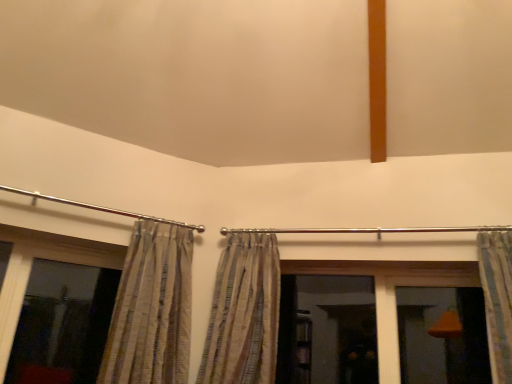
This screenshot has height=384, width=512. Describe the element at coordinates (497, 299) in the screenshot. I see `striped fabric curtain at right, which ranks as the 1th curtain in right-to-left order` at that location.

Describe the element at coordinates (151, 309) in the screenshot. I see `striped fabric curtain at left, which is the first curtain in left-to-right order` at that location.

You are a GUI agent. You are given a task and a screenshot of the screen. Output one action in this format:
    pyautogui.click(x=<x>, y=<y>)
    Task: Click on the striped fabric curtain at right, which ranks as the 1th curtain in right-to-left order
    This screenshot has height=384, width=512.
    Given the screenshot: What is the action you would take?
    pyautogui.click(x=497, y=299)

Is striped fabric curtain at left, which is the first curtain in left-to-right order, located outside striped fabric curtain at center, which is the second curtain from right to left?

Absolutely, striped fabric curtain at left, which is the first curtain in left-to-right order, is external to striped fabric curtain at center, which is the second curtain from right to left.

Is striped fabric curtain at left, which is the third curtain from right to left, wider or thinner than striped fabric curtain at center, which is the second curtain from right to left?

Clearly, striped fabric curtain at left, which is the third curtain from right to left, has less width compared to striped fabric curtain at center, which is the second curtain from right to left.

From a real-world perspective, is striped fabric curtain at left, which is the first curtain in left-to-right order, physically above striped fabric curtain at center, marked as the second curtain in a left-to-right arrangement?

Actually, striped fabric curtain at left, which is the first curtain in left-to-right order, is physically below striped fabric curtain at center, marked as the second curtain in a left-to-right arrangement, in the real world.

Is striped fabric curtain at left, which is the third curtain from right to left, placed right next to striped fabric curtain at center, which is the second curtain from right to left?

No, striped fabric curtain at left, which is the third curtain from right to left, is not touching striped fabric curtain at center, which is the second curtain from right to left.

Can you confirm if striped fabric curtain at left, which is the first curtain in left-to-right order, is shorter than transparent glass window at left?

Incorrect, the height of striped fabric curtain at left, which is the first curtain in left-to-right order, does not fall short of that of transparent glass window at left.

From a real-world perspective, is striped fabric curtain at left, which is the third curtain from right to left, physically located above or below transparent glass window at left?

striped fabric curtain at left, which is the third curtain from right to left, is above transparent glass window at left.

Is striped fabric curtain at left, which is the third curtain from right to left, positioned before transparent glass window at left?

Yes, striped fabric curtain at left, which is the third curtain from right to left, is in front of transparent glass window at left.

Locate an element on the screen. The width and height of the screenshot is (512, 384). window behind the striped fabric curtain at left, which is the first curtain in left-to-right order is located at coordinates (30, 269).

Is striped fabric curtain at left, which is the third curtain from right to left, at the left side of striped fabric curtain at right, which ranks as the 1th curtain in right-to-left order?

Correct, you'll find striped fabric curtain at left, which is the third curtain from right to left, to the left of striped fabric curtain at right, which ranks as the 1th curtain in right-to-left order.

The height and width of the screenshot is (384, 512). Identify the location of the 2nd curtain directly beneath the striped fabric curtain at right, the third curtain when ordered from left to right (from a real-world perspective). (151, 309).

From the image's perspective, is striped fabric curtain at left, which is the first curtain in left-to-right order, positioned above or below striped fabric curtain at right, the third curtain when ordered from left to right?

striped fabric curtain at left, which is the first curtain in left-to-right order, is situated lower than striped fabric curtain at right, the third curtain when ordered from left to right, in the image.

Is striped fabric curtain at left, which is the first curtain in left-to-right order, bigger than striped fabric curtain at right, the third curtain when ordered from left to right?

Indeed, striped fabric curtain at left, which is the first curtain in left-to-right order, has a larger size compared to striped fabric curtain at right, the third curtain when ordered from left to right.

Between transparent glass window at left and striped fabric curtain at center, marked as the second curtain in a left-to-right arrangement, which one has smaller size?

transparent glass window at left is smaller.

From a real-world perspective, is transparent glass window at left physically located above or below striped fabric curtain at center, which is the second curtain from right to left?

From a real-world perspective, transparent glass window at left is physically below striped fabric curtain at center, which is the second curtain from right to left.

In the scene shown: How many degrees apart are the facing directions of transparent glass window at left and striped fabric curtain at center, marked as the second curtain in a left-to-right arrangement?

45.2 degrees separate the facing orientations of transparent glass window at left and striped fabric curtain at center, marked as the second curtain in a left-to-right arrangement.

Can you confirm if transparent glass window at left is taller than striped fabric curtain at center, marked as the second curtain in a left-to-right arrangement?

No.

How many degrees apart are the facing directions of striped fabric curtain at center, which is the second curtain from right to left, and striped fabric curtain at left, which is the first curtain in left-to-right order?

There is a 36.2-degree angle between the facing directions of striped fabric curtain at center, which is the second curtain from right to left, and striped fabric curtain at left, which is the first curtain in left-to-right order.

Does striped fabric curtain at center, marked as the second curtain in a left-to-right arrangement, contain striped fabric curtain at left, which is the first curtain in left-to-right order?

Actually, striped fabric curtain at left, which is the first curtain in left-to-right order, is outside striped fabric curtain at center, marked as the second curtain in a left-to-right arrangement.

Is striped fabric curtain at center, marked as the second curtain in a left-to-right arrangement, at the right side of striped fabric curtain at left, which is the first curtain in left-to-right order?

Yes.

Is striped fabric curtain at center, marked as the second curtain in a left-to-right arrangement, facing away from striped fabric curtain at left, which is the third curtain from right to left?

No, striped fabric curtain at center, marked as the second curtain in a left-to-right arrangement, is not facing away from striped fabric curtain at left, which is the third curtain from right to left.

Is striped fabric curtain at right, the third curtain when ordered from left to right, taller than striped fabric curtain at center, marked as the second curtain in a left-to-right arrangement?

In fact, striped fabric curtain at right, the third curtain when ordered from left to right, may be shorter than striped fabric curtain at center, marked as the second curtain in a left-to-right arrangement.

From a real-world perspective, who is located lower, striped fabric curtain at right, which ranks as the 1th curtain in right-to-left order, or striped fabric curtain at center, marked as the second curtain in a left-to-right arrangement?

striped fabric curtain at center, marked as the second curtain in a left-to-right arrangement, from a real-world perspective.

Considering the relative positions of striped fabric curtain at right, the third curtain when ordered from left to right, and striped fabric curtain at center, which is the second curtain from right to left, in the image provided, is striped fabric curtain at right, the third curtain when ordered from left to right, in front of striped fabric curtain at center, which is the second curtain from right to left,?

Yes, it is in front of striped fabric curtain at center, which is the second curtain from right to left.

Locate an element on the screen. This screenshot has height=384, width=512. the 2nd curtain behind the striped fabric curtain at right, which ranks as the 1th curtain in right-to-left order is located at coordinates (244, 312).

Is striped fabric curtain at center, marked as the second curtain in a left-to-right arrangement, far away from transparent glass window at left?

No.

Considering the relative sizes of striped fabric curtain at center, which is the second curtain from right to left, and transparent glass window at left in the image provided, is striped fabric curtain at center, which is the second curtain from right to left, wider than transparent glass window at left?

Yes.

From the image's perspective, which curtain is the 1st one above the transparent glass window at left? Please provide its 2D coordinates.

[(244, 312)]

Identify the location of the 1st curtain to the right of the striped fabric curtain at left, which is the third curtain from right to left, starting your count from the anchor. (244, 312).

From the image's perspective, starting from the transparent glass window at left, which curtain is the 2nd one above? Please provide its 2D coordinates.

[(151, 309)]

When comparing their distances from transparent glass window at left, does striped fabric curtain at center, marked as the second curtain in a left-to-right arrangement, or striped fabric curtain at left, which is the third curtain from right to left, seem further?

striped fabric curtain at center, marked as the second curtain in a left-to-right arrangement, is further to transparent glass window at left.

Which object lies nearer to the anchor point striped fabric curtain at left, which is the first curtain in left-to-right order, striped fabric curtain at center, which is the second curtain from right to left, or transparent glass window at left?

striped fabric curtain at center, which is the second curtain from right to left, lies closer to striped fabric curtain at left, which is the first curtain in left-to-right order, than the other object.

Looking at this image, estimate the real-world distances between objects in this image. Which object is closer to transparent glass window at left, striped fabric curtain at right, the third curtain when ordered from left to right, or striped fabric curtain at left, which is the third curtain from right to left?

striped fabric curtain at left, which is the third curtain from right to left, is positioned closer to the anchor transparent glass window at left.

Based on their spatial positions, is striped fabric curtain at left, which is the first curtain in left-to-right order, or transparent glass window at left further from striped fabric curtain at right, which ranks as the 1th curtain in right-to-left order?

transparent glass window at left.

Considering their positions, is transparent glass window at left positioned closer to striped fabric curtain at right, the third curtain when ordered from left to right, than striped fabric curtain at center, which is the second curtain from right to left?

Based on the image, striped fabric curtain at center, which is the second curtain from right to left, appears to be nearer to striped fabric curtain at right, the third curtain when ordered from left to right.

Which object lies further to the anchor point striped fabric curtain at right, which ranks as the 1th curtain in right-to-left order, striped fabric curtain at left, which is the first curtain in left-to-right order, or striped fabric curtain at center, which is the second curtain from right to left?

striped fabric curtain at left, which is the first curtain in left-to-right order, lies further to striped fabric curtain at right, which ranks as the 1th curtain in right-to-left order, than the other object.

Estimate the real-world distances between objects in this image. Which object is further from striped fabric curtain at right, which ranks as the 1th curtain in right-to-left order, striped fabric curtain at center, marked as the second curtain in a left-to-right arrangement, or transparent glass window at left?

Among the two, transparent glass window at left is located further to striped fabric curtain at right, which ranks as the 1th curtain in right-to-left order.

Based on their spatial positions, is striped fabric curtain at left, which is the first curtain in left-to-right order, or striped fabric curtain at right, the third curtain when ordered from left to right, closer to striped fabric curtain at center, which is the second curtain from right to left?

striped fabric curtain at left, which is the first curtain in left-to-right order.

I want to click on curtain located between striped fabric curtain at left, which is the first curtain in left-to-right order, and striped fabric curtain at right, which ranks as the 1th curtain in right-to-left order, in the left-right direction, so click(244, 312).

The width and height of the screenshot is (512, 384). In order to click on curtain located between transparent glass window at left and striped fabric curtain at center, marked as the second curtain in a left-to-right arrangement, in the left-right direction in this screenshot , I will do `click(151, 309)`.